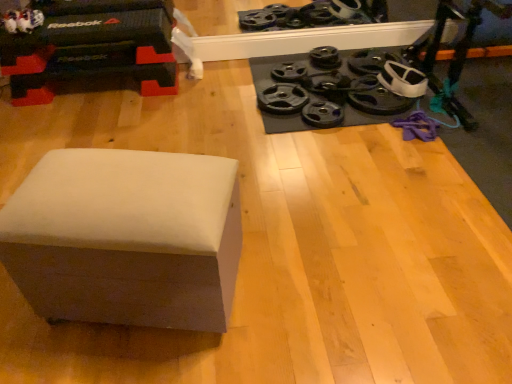
Question: Does black rubber weight plate at upper right, acting as the 2th wheel starting from the left, turn towards black rubber weight plate at upper right, positioned as the 7th wheel in left-to-right order?

Choices:
 (A) yes
 (B) no

Answer: (B)

Question: Would you consider black rubber weight plate at upper right, acting as the 2th wheel starting from the left, to be distant from black rubber weight plate at upper right, the 1th wheel positioned from the right?

Choices:
 (A) yes
 (B) no

Answer: (B)

Question: Is black rubber weight plate at upper right, which is counted as the 6th wheel, starting from the right, further to the viewer compared to black rubber weight plate at upper right, the 1th wheel positioned from the right?

Choices:
 (A) no
 (B) yes

Answer: (B)

Question: Can you confirm if black rubber weight plate at upper right, acting as the 2th wheel starting from the left, is thinner than black rubber weight plate at upper right, positioned as the 7th wheel in left-to-right order?

Choices:
 (A) yes
 (B) no

Answer: (A)

Question: Would you say black rubber weight plate at upper right, acting as the 2th wheel starting from the left, is outside black rubber weight plate at upper right, positioned as the 7th wheel in left-to-right order?

Choices:
 (A) no
 (B) yes

Answer: (B)

Question: Considering the positions of black rubber weight plate at center-right, placed as the seventh wheel when sorted from right to left, and black rubber weight plate at center-right, the 3th wheel positioned from the left, in the image, is black rubber weight plate at center-right, placed as the seventh wheel when sorted from right to left, taller or shorter than black rubber weight plate at center-right, the 3th wheel positioned from the left,?

Choices:
 (A) tall
 (B) short

Answer: (A)

Question: Do you think black rubber weight plate at center-right, the 1th wheel positioned from the left, is within black rubber weight plate at center-right, which is the fifth wheel from right to left, or outside of it?

Choices:
 (A) inside
 (B) outside

Answer: (B)

Question: From a real-world perspective, is black rubber weight plate at center-right, the 1th wheel positioned from the left, physically located above or below black rubber weight plate at center-right, the 3th wheel positioned from the left?

Choices:
 (A) above
 (B) below

Answer: (A)

Question: Looking at the image, does black rubber weight plate at center-right, placed as the seventh wheel when sorted from right to left, seem bigger or smaller compared to black rubber weight plate at center-right, the 3th wheel positioned from the left?

Choices:
 (A) big
 (B) small

Answer: (A)

Question: From their relative heights in the image, would you say black rubber weight plate at upper center, acting as the 5th wheel starting from the left, is taller or shorter than white plush toy at upper left?

Choices:
 (A) short
 (B) tall

Answer: (A)

Question: Is black rubber weight plate at upper center, which ranks as the third wheel in right-to-left order, bigger or smaller than white plush toy at upper left?

Choices:
 (A) small
 (B) big

Answer: (A)

Question: From a real-world perspective, is black rubber weight plate at upper center, acting as the 5th wheel starting from the left, physically located above or below white plush toy at upper left?

Choices:
 (A) below
 (B) above

Answer: (A)

Question: Considering the relative positions of black rubber weight plate at upper center, which ranks as the third wheel in right-to-left order, and white plush toy at upper left in the image provided, is black rubber weight plate at upper center, which ranks as the third wheel in right-to-left order, to the left or to the right of white plush toy at upper left?

Choices:
 (A) right
 (B) left

Answer: (A)

Question: Would you say black rubber weight plate at upper right, the 4th wheel when ordered from left to right, is inside or outside black rubber weight plate at center-right, placed as the seventh wheel when sorted from right to left?

Choices:
 (A) outside
 (B) inside

Answer: (A)

Question: Considering the positions of black rubber weight plate at upper right, acting as the 4th wheel starting from the right, and black rubber weight plate at center-right, the 1th wheel positioned from the left, in the image, is black rubber weight plate at upper right, acting as the 4th wheel starting from the right, taller or shorter than black rubber weight plate at center-right, the 1th wheel positioned from the left,?

Choices:
 (A) tall
 (B) short

Answer: (A)